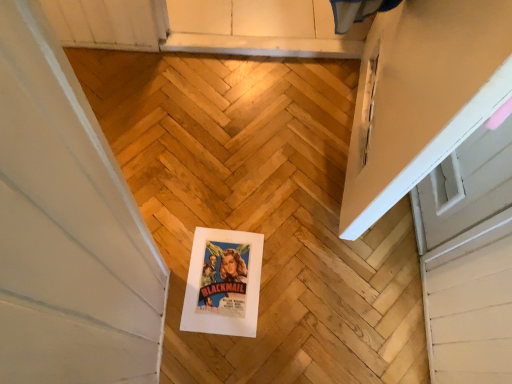
Identify the location of free region under matte paper poster at center (from a real-world perspective). (229, 282).